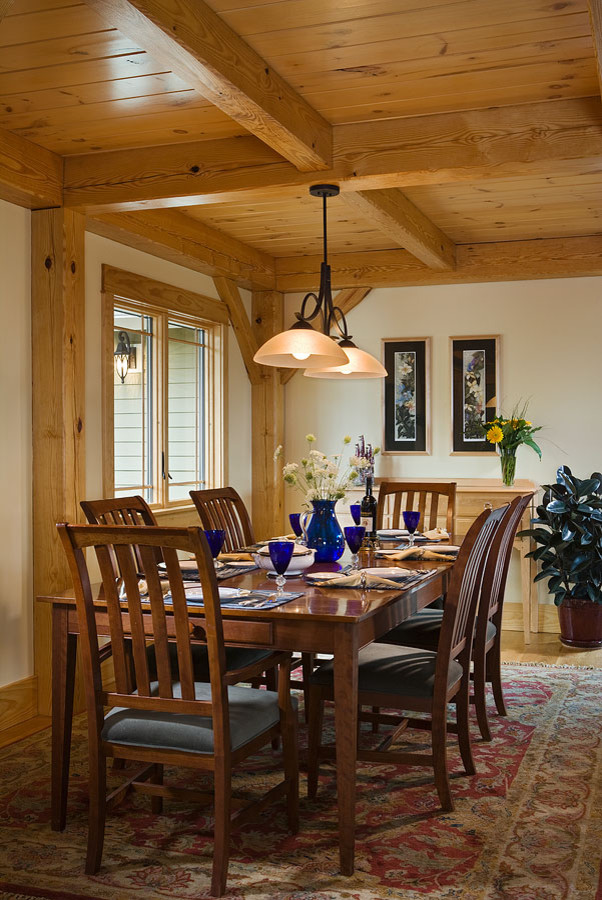
You are a GUI agent. You are given a task and a screenshot of the screen. Output one action in this format:
    pyautogui.click(x=<x>, y=<y>)
    Task: Click on the vase
    Image resolution: width=602 pixels, height=900 pixels.
    Given the screenshot: What is the action you would take?
    pyautogui.click(x=323, y=601), pyautogui.click(x=323, y=529), pyautogui.click(x=509, y=459)